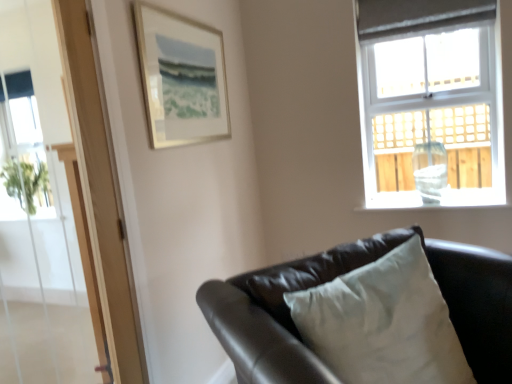
Question: Is the position of transparent glass vase at window less distant than that of matte black couch at lower right?

Choices:
 (A) no
 (B) yes

Answer: (A)

Question: Considering the relative sizes of transparent glass vase at window and matte black couch at lower right in the image provided, is transparent glass vase at window smaller than matte black couch at lower right?

Choices:
 (A) no
 (B) yes

Answer: (B)

Question: Is transparent glass vase at window far from matte black couch at lower right?

Choices:
 (A) yes
 (B) no

Answer: (A)

Question: From a real-world perspective, is transparent glass vase at window positioned under matte black couch at lower right based on gravity?

Choices:
 (A) no
 (B) yes

Answer: (A)

Question: Does transparent glass vase at window have a larger size compared to matte black couch at lower right?

Choices:
 (A) yes
 (B) no

Answer: (B)

Question: Is matte black couch at lower right a part of transparent glass vase at window?

Choices:
 (A) no
 (B) yes

Answer: (A)

Question: Is matte black couch at lower right at the right side of transparent glass vase at window?

Choices:
 (A) no
 (B) yes

Answer: (A)

Question: Is the depth of matte black couch at lower right greater than that of transparent glass vase at window?

Choices:
 (A) no
 (B) yes

Answer: (A)

Question: Can you confirm if matte black couch at lower right is shorter than transparent glass vase at window?

Choices:
 (A) yes
 (B) no

Answer: (B)

Question: Considering the relative sizes of matte black couch at lower right and transparent glass vase at window in the image provided, is matte black couch at lower right thinner than transparent glass vase at window?

Choices:
 (A) yes
 (B) no

Answer: (B)

Question: Is matte black couch at lower right far from transparent glass vase at window?

Choices:
 (A) yes
 (B) no

Answer: (A)

Question: Is matte black couch at lower right outside transparent glass vase at window?

Choices:
 (A) yes
 (B) no

Answer: (A)

Question: Is matte black couch at lower right beside transparent glass screen door at upper left?

Choices:
 (A) yes
 (B) no

Answer: (B)